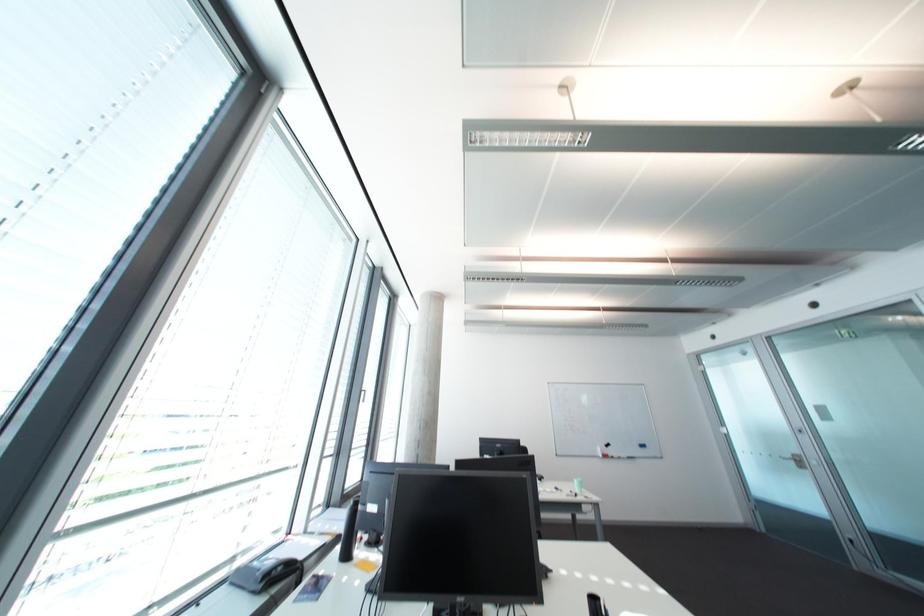
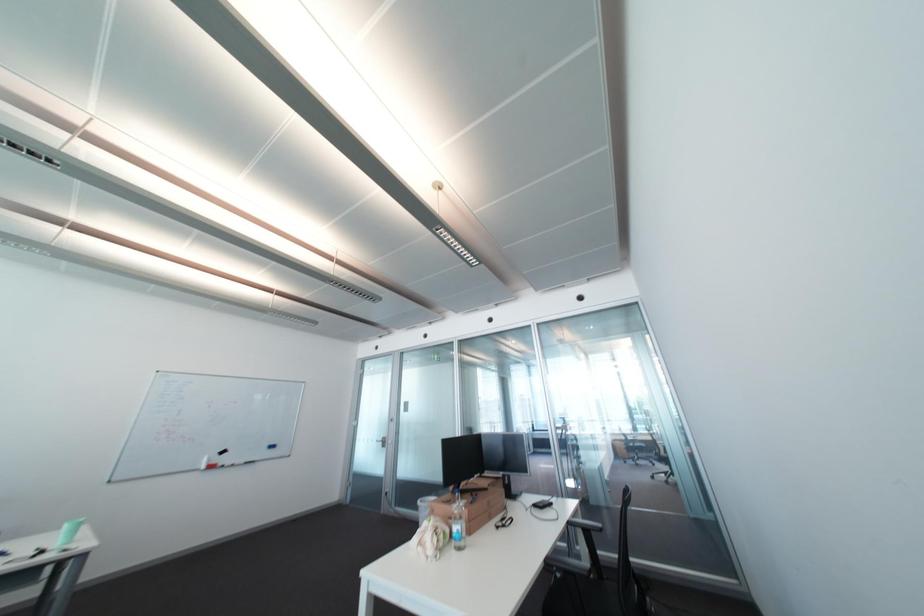
Question: The camera is either moving clockwise (left) or counter-clockwise (right) around the object. The first image is from the beginning of the video and the second image is from the end. Is the camera moving left or right when shooting the video?

Choices:
 (A) Left
 (B) Right

Answer: (A)